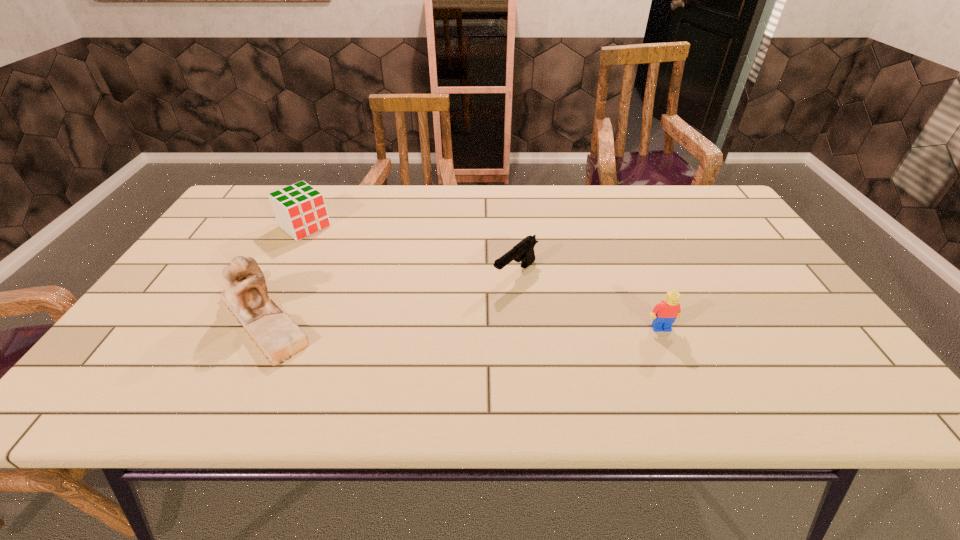
Locate an element on the screen. free spot located on the red face of the cube is located at coordinates (371, 278).

The image size is (960, 540). Identify the location of vacant space situated on the red face of the cube. (349, 261).

This screenshot has width=960, height=540. Find the location of `object located at the far edge`. object located at the far edge is located at coordinates [300, 210].

Where is `object positioned at the near edge`? Image resolution: width=960 pixels, height=540 pixels. object positioned at the near edge is located at coordinates (274, 332).

This screenshot has height=540, width=960. Find the location of `object located in the left edge section of the desktop`. object located in the left edge section of the desktop is located at coordinates (274, 332).

Locate an element on the screen. The height and width of the screenshot is (540, 960). object situated at the near left corner is located at coordinates click(274, 332).

Locate an element on the screen. The width and height of the screenshot is (960, 540). vacant space at the far edge is located at coordinates (597, 217).

In the image, there is a desktop. Identify the location of vacant space at the near edge. The image size is (960, 540). (554, 351).

In the image, there is a desktop. Where is `vacant space at the left edge`? vacant space at the left edge is located at coordinates (190, 295).

Identify the location of free space at the far left corner of the desktop. The image size is (960, 540). (229, 216).